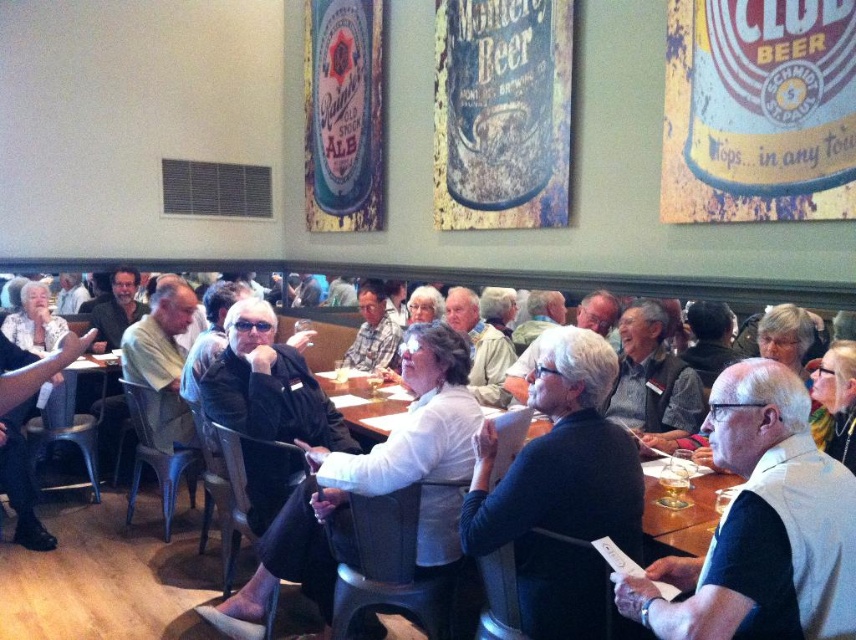
Question: Does white shirt at center appear over black leather jacket at center?

Choices:
 (A) no
 (B) yes

Answer: (A)

Question: Which point appears closest to the camera in this image?

Choices:
 (A) (708, 470)
 (B) (750, 618)
 (C) (417, 342)

Answer: (B)

Question: Is white fabric vest at center further to camera compared to white shirt at center?

Choices:
 (A) no
 (B) yes

Answer: (A)

Question: Estimate the real-world distances between objects in this image. Which object is closer to the white shirt at center?

Choices:
 (A) black leather jacket at center
 (B) white fabric vest at center
 (C) black matte sweater at center

Answer: (A)

Question: Which object is positioned farthest from the black matte sweater at center?

Choices:
 (A) black leather jacket at center
 (B) white fabric vest at center

Answer: (A)

Question: Is white fabric vest at center positioned at the back of black matte sweater at center?

Choices:
 (A) no
 (B) yes

Answer: (A)